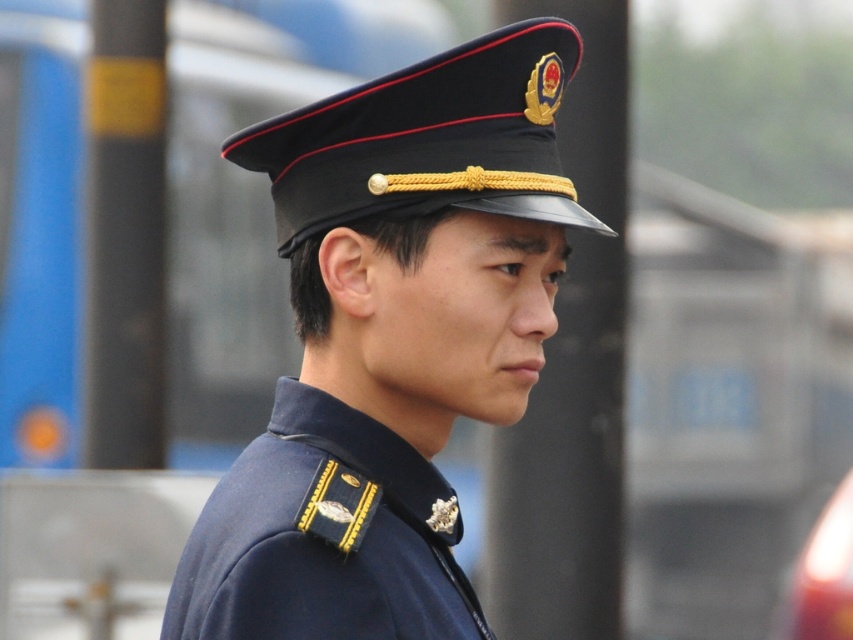
Question: Which of the following is the farthest from the observer?

Choices:
 (A) (329, 474)
 (B) (212, 589)

Answer: (A)

Question: Is the position of navy blue uniform at center less distant than that of navy blue fabric at center?

Choices:
 (A) yes
 (B) no

Answer: (A)

Question: Among these objects, which one is farthest from the camera?

Choices:
 (A) navy blue fabric at center
 (B) navy blue uniform at center

Answer: (A)

Question: Can you confirm if navy blue uniform at center is positioned below navy blue fabric at center?

Choices:
 (A) yes
 (B) no

Answer: (B)

Question: Does navy blue uniform at center lie behind navy blue fabric at center?

Choices:
 (A) no
 (B) yes

Answer: (A)